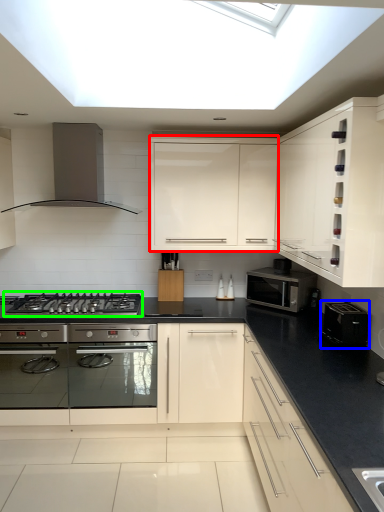
Question: Considering the real-world distances, which object is farthest from cabinetry (highlighted by a red box)? appliance (highlighted by a blue box) or gas stove (highlighted by a green box)?

Choices:
 (A) appliance
 (B) gas stove

Answer: (A)